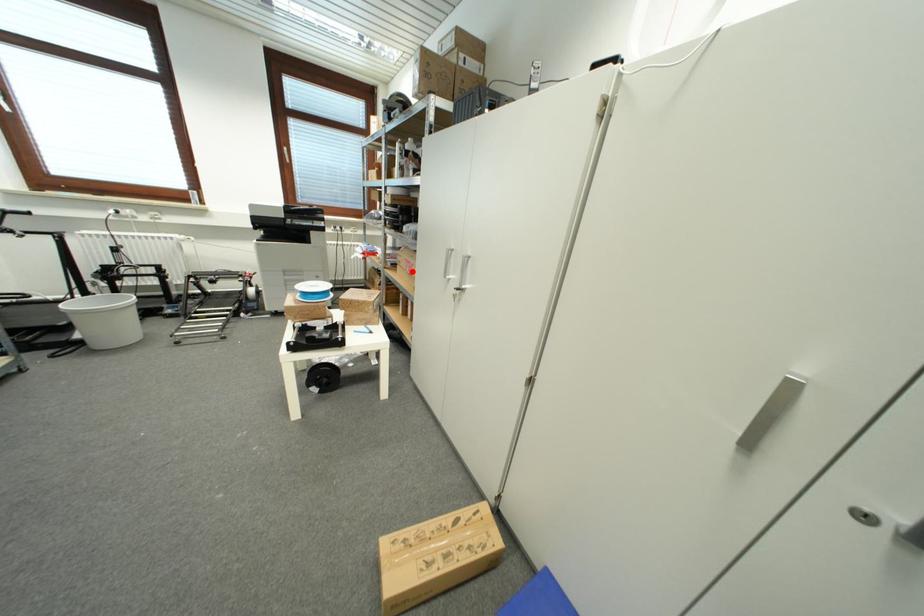
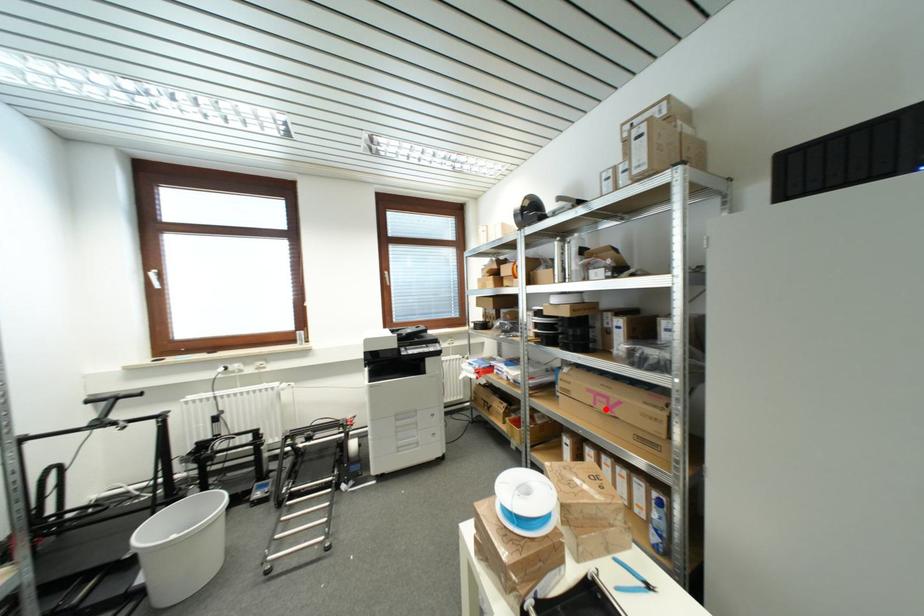
I am providing you with two images of the same scene from different viewpoints. A red point is marked on the first image and another point is marked on the second image. Does the point marked in image1 correspond to the same location as the one in image2?

Yes